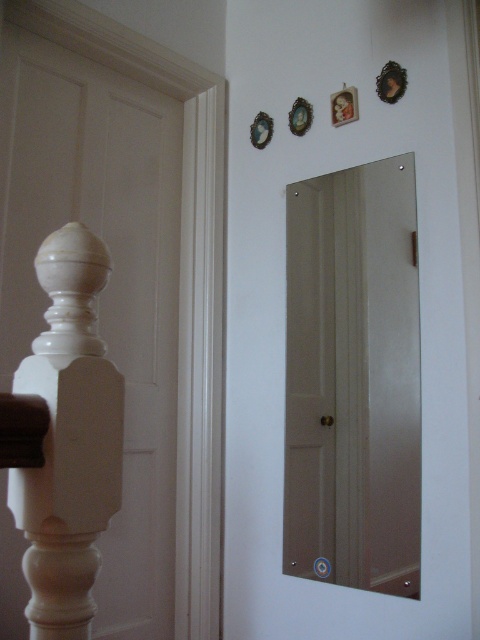
Can you confirm if white matte wooden door at left is smaller than matte white balustrade at left?

Incorrect, white matte wooden door at left is not smaller in size than matte white balustrade at left.

Does white matte wooden door at left have a greater height compared to matte white balustrade at left?

Yes.

Where is `white matte wooden door at left`? The width and height of the screenshot is (480, 640). white matte wooden door at left is located at coordinates (107, 284).

Who is taller, clear glass mirror at center or white matte wooden post at left?

clear glass mirror at center is taller.

Can you confirm if clear glass mirror at center is taller than white matte wooden post at left?

Indeed, clear glass mirror at center has a greater height compared to white matte wooden post at left.

Which is behind, point (369, 401) or point (61, 310)?

The point (369, 401) is more distant.

Where is `clear glass mirror at center`? The width and height of the screenshot is (480, 640). clear glass mirror at center is located at coordinates (354, 380).

Between white matte wooden door at left and clear glass mirror at center, which one is positioned lower?

clear glass mirror at center is lower down.

Can you confirm if white matte wooden door at left is positioned to the left of clear glass mirror at center?

Correct, you'll find white matte wooden door at left to the left of clear glass mirror at center.

What do you see at coordinates (107, 284) in the screenshot? I see `white matte wooden door at left` at bounding box center [107, 284].

Where is `white matte wooden door at left`? Image resolution: width=480 pixels, height=640 pixels. white matte wooden door at left is located at coordinates (107, 284).